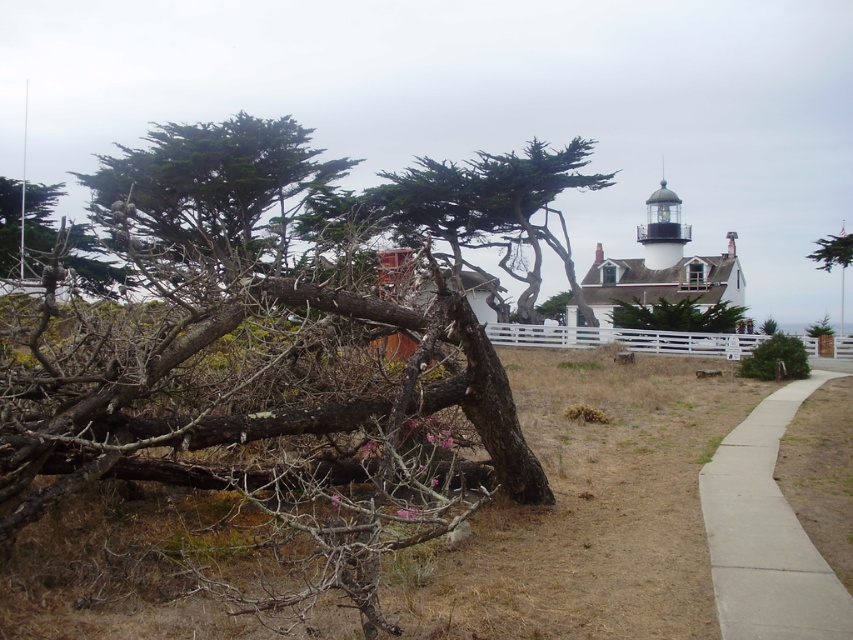
Question: Is green needle-like foliage at upper left thinner than white wooden fence at center?

Choices:
 (A) no
 (B) yes

Answer: (A)

Question: Among these objects, which one is farthest from the camera?

Choices:
 (A) green needle-like foliage at upper left
 (B) white wooden fence at center
 (C) brown rough bark tree at left

Answer: (B)

Question: Which point is closer to the camera?

Choices:
 (A) green needle-like foliage at upper left
 (B) green matte tree at center
 (C) white wooden fence at center
 (D) concrete sidewalk at lower right

Answer: (D)

Question: Can you confirm if brown rough bark tree at left is positioned to the right of green needle-like foliage at upper left?

Choices:
 (A) yes
 (B) no

Answer: (A)

Question: Among these points, which one is farthest from the camera?

Choices:
 (A) click(746, 490)
 (B) click(117, 177)
 (C) click(502, 342)
 (D) click(647, 317)

Answer: (B)

Question: Is green needle-like foliage at upper left bigger than green matte tree at center?

Choices:
 (A) no
 (B) yes

Answer: (B)